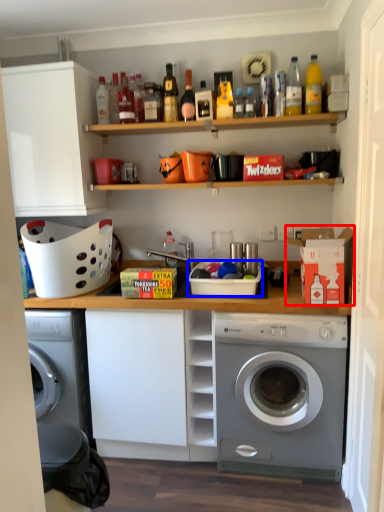
Question: Which object appears farthest to the camera in this image, cardboard box (highlighted by a red box) or basket (highlighted by a blue box)?

Choices:
 (A) cardboard box
 (B) basket

Answer: (B)